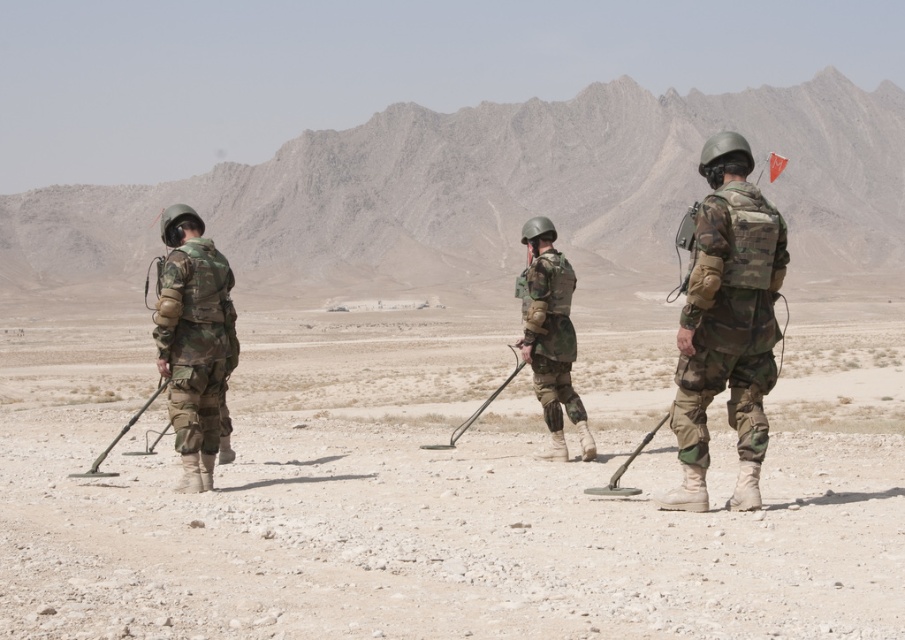
You are a soldier in the desert searching for buried objects. You notice the dull brown dirt at center and the camouflage fabric helmet at center. Which object is lower in position?

The dull brown dirt at center is below camouflage fabric helmet at center, so the dull brown dirt at center is lower in position.

You are a drone operator observing the soldiers in the desert. You need to determine the order of the objects from closest to farthest from your viewpoint. Which is closer to you between the camouflage fabric helmet at left and the metallic black metal detector at center?

The camouflage fabric helmet at left is closer to you because it is in front of the metallic black metal detector at center.

You are a drone operator controlling a drone that needs to fly from point A to point B. The coordinates for point A are point (538, 228) and for point B are point (93, 467). Given that the drone can only fly over the soldiers and not through them, which point should you take off from first to ensure a clear path?

You should take off from point A first because it is closer to the viewer than point B. Since the drone can only fly over the soldiers and not through them, starting from the closer point allows the drone to navigate over the soldiers without obstruction.